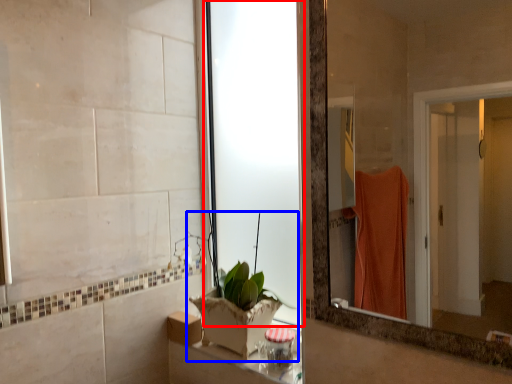
Question: Which object appears closest to the camera in this image, glass door (highlighted by a red box) or houseplant (highlighted by a blue box)?

Choices:
 (A) glass door
 (B) houseplant

Answer: (B)